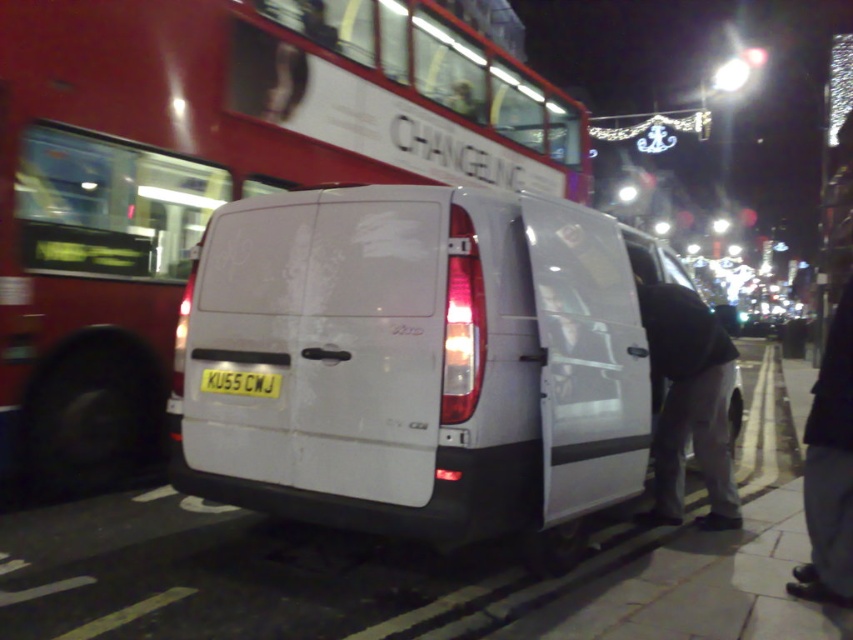
Question: Which object is the farthest from the red metallic bus at upper center?

Choices:
 (A) dark gray pants at lower right
 (B) yellow matte license plate at center
 (C) white matte van at center

Answer: (A)

Question: Can you confirm if red metallic bus at upper center is positioned to the right of black fabric pants at lower right?

Choices:
 (A) yes
 (B) no

Answer: (B)

Question: Does dark gray pants at lower right appear on the left side of yellow matte license plate at center?

Choices:
 (A) yes
 (B) no

Answer: (B)

Question: Which object is positioned closest to the black fabric pants at lower right?

Choices:
 (A) red metallic bus at upper center
 (B) yellow matte license plate at center

Answer: (B)

Question: Which object is closer to the camera taking this photo?

Choices:
 (A) black fabric pants at lower right
 (B) white matte van at center
 (C) dark gray pants at lower right

Answer: (B)

Question: Does dark gray pants at lower right have a lesser width compared to yellow matte license plate at center?

Choices:
 (A) yes
 (B) no

Answer: (B)